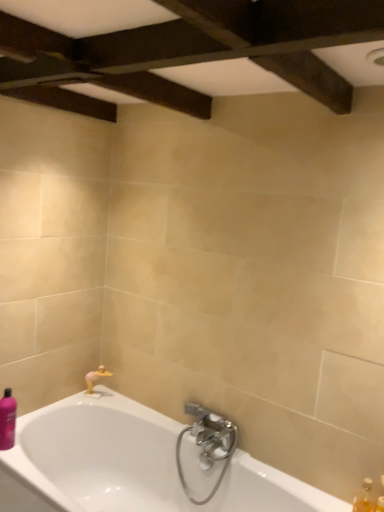
This screenshot has height=512, width=384. Find the location of `purple glossy bottle at lower left, which is counted as the first toiletry, starting from the top`. purple glossy bottle at lower left, which is counted as the first toiletry, starting from the top is located at coordinates (7, 420).

This screenshot has height=512, width=384. What do you see at coordinates (7, 420) in the screenshot?
I see `purple glossy bottle at lower left, the 1th toiletry from the left` at bounding box center [7, 420].

What are the coordinates of `translucent amber bottle at lower right` in the screenshot? It's located at (365, 498).

Locate an element on the screen. white glossy bathtub at lower left is located at coordinates (129, 465).

Is translucent amber bottle at lower right located within white glossy bathtub at lower left?

No.

From the image's perspective, would you say white glossy bathtub at lower left is positioned over translucent amber bottle at lower right?

No, from the image's perspective, white glossy bathtub at lower left is not above translucent amber bottle at lower right.

Between white glossy bathtub at lower left and translucent amber bottle at lower right, which one appears on the right side from the viewer's perspective?

From the viewer's perspective, translucent amber bottle at lower right appears more on the right side.

Is point (94, 434) positioned in front of point (381, 478)?

No, (94, 434) is behind (381, 478).

Would you say white glossy bathtub at lower left contains translucent plastic soap at lower right, the 2th toiletry in the left-to-right sequence?

Definitely not — translucent plastic soap at lower right, the 2th toiletry in the left-to-right sequence, is not inside white glossy bathtub at lower left.

Considering the sizes of white glossy bathtub at lower left and translucent plastic soap at lower right, the first toiletry ordered from the bottom, in the image, is white glossy bathtub at lower left taller or shorter than translucent plastic soap at lower right, the first toiletry ordered from the bottom,?

In the image, white glossy bathtub at lower left appears to be taller than translucent plastic soap at lower right, the first toiletry ordered from the bottom.

From the image's perspective, does white glossy bathtub at lower left appear lower than translucent plastic soap at lower right, the first toiletry ordered from the bottom?

Yes, from the image's perspective, white glossy bathtub at lower left is below translucent plastic soap at lower right, the first toiletry ordered from the bottom.

Are purple glossy bottle at lower left, which is counted as the first toiletry, starting from the top, and translucent plastic soap at lower right, which is the 1th toiletry in front-to-back order, far apart?

Yes, purple glossy bottle at lower left, which is counted as the first toiletry, starting from the top, is far from translucent plastic soap at lower right, which is the 1th toiletry in front-to-back order.

From the image's perspective, is purple glossy bottle at lower left, the 1th toiletry from the left, positioned above or below translucent plastic soap at lower right, the first toiletry ordered from the bottom?

Based on their image positions, purple glossy bottle at lower left, the 1th toiletry from the left, is located above translucent plastic soap at lower right, the first toiletry ordered from the bottom.

Are translucent plastic soap at lower right, the second toiletry when ordered from top to bottom, and white glossy bathtub at lower left far apart?

Yes, translucent plastic soap at lower right, the second toiletry when ordered from top to bottom, and white glossy bathtub at lower left are located far from each other.

From the image's perspective, is translucent plastic soap at lower right, which is the 2th toiletry from back to front, on white glossy bathtub at lower left?

Yes, from the image's perspective, translucent plastic soap at lower right, which is the 2th toiletry from back to front, is over white glossy bathtub at lower left.

Who is smaller, translucent plastic soap at lower right, which is the 1th toiletry in front-to-back order, or white glossy bathtub at lower left?

translucent plastic soap at lower right, which is the 1th toiletry in front-to-back order.

Is translucent plastic soap at lower right, which is the 2th toiletry from back to front, to the left or to the right of white glossy bathtub at lower left in the image?

Based on their positions, translucent plastic soap at lower right, which is the 2th toiletry from back to front, is located to the right of white glossy bathtub at lower left.

Is translucent plastic soap at lower right, the second toiletry when ordered from top to bottom, shorter than translucent amber bottle at lower right?

Incorrect, the height of translucent plastic soap at lower right, the second toiletry when ordered from top to bottom, does not fall short of that of translucent amber bottle at lower right.

Consider the image. Is the depth of translucent plastic soap at lower right, the 2th toiletry in the left-to-right sequence, less than that of translucent amber bottle at lower right?

Yes, translucent plastic soap at lower right, the 2th toiletry in the left-to-right sequence, is closer to the viewer.

Based on the photo, does translucent plastic soap at lower right, arranged as the first toiletry when viewed from the right, have a greater width compared to translucent amber bottle at lower right?

Yes, translucent plastic soap at lower right, arranged as the first toiletry when viewed from the right, is wider than translucent amber bottle at lower right.

From a real-world perspective, does translucent plastic soap at lower right, the second toiletry when ordered from top to bottom, sit lower than translucent amber bottle at lower right?

No, from a real-world perspective, translucent plastic soap at lower right, the second toiletry when ordered from top to bottom, is not under translucent amber bottle at lower right.

Which of these two, translucent plastic soap at lower right, the 2th toiletry in the left-to-right sequence, or purple glossy bottle at lower left, the 1th toiletry in the back-to-front sequence, is thinner?

translucent plastic soap at lower right, the 2th toiletry in the left-to-right sequence, is thinner.

Based on the photo, considering the relative positions of translucent plastic soap at lower right, which is the 2th toiletry from back to front, and purple glossy bottle at lower left, placed as the second toiletry when sorted from right to left, in the image provided, is translucent plastic soap at lower right, which is the 2th toiletry from back to front, in front of purple glossy bottle at lower left, placed as the second toiletry when sorted from right to left,?

Yes, it is.

Measure the distance between translucent plastic soap at lower right, which is the 1th toiletry in front-to-back order, and purple glossy bottle at lower left, acting as the 2th toiletry starting from the bottom.

They are 5.01 feet apart.

Is translucent amber bottle at lower right beside purple glossy bottle at lower left, the 1th toiletry from the left?

No, translucent amber bottle at lower right is not touching purple glossy bottle at lower left, the 1th toiletry from the left.

Which is behind, translucent amber bottle at lower right or purple glossy bottle at lower left, placed as the second toiletry when sorted from right to left?

purple glossy bottle at lower left, placed as the second toiletry when sorted from right to left, is more distant.

Between translucent amber bottle at lower right and purple glossy bottle at lower left, placed as the second toiletry when sorted from right to left, which one has less height?

translucent amber bottle at lower right is shorter.

Is translucent amber bottle at lower right facing towards purple glossy bottle at lower left, placed as the second toiletry when sorted from right to left?

No, translucent amber bottle at lower right is not facing towards purple glossy bottle at lower left, placed as the second toiletry when sorted from right to left.

Image resolution: width=384 pixels, height=512 pixels. Find the location of `bathtub that appears in front of the translucent amber bottle at lower right`. bathtub that appears in front of the translucent amber bottle at lower right is located at coordinates (129, 465).

Which toiletry is the 1st one when counting from the back of the white glossy bathtub at lower left? Please provide its 2D coordinates.

[(380, 504)]

Based on their spatial positions, is translucent amber bottle at lower right or purple glossy bottle at lower left, acting as the 2th toiletry starting from the bottom, closer to white glossy bathtub at lower left?

Among the two, purple glossy bottle at lower left, acting as the 2th toiletry starting from the bottom, is located nearer to white glossy bathtub at lower left.

Which object lies further to the anchor point purple glossy bottle at lower left, acting as the 2th toiletry starting from the bottom, translucent amber bottle at lower right or white glossy bathtub at lower left?

translucent amber bottle at lower right is further to purple glossy bottle at lower left, acting as the 2th toiletry starting from the bottom.

When comparing their distances from white glossy bathtub at lower left, does translucent plastic soap at lower right, which is the 2th toiletry from back to front, or translucent amber bottle at lower right seem closer?

Based on the image, translucent amber bottle at lower right appears to be nearer to white glossy bathtub at lower left.

Estimate the real-world distances between objects in this image. Which object is closer to translucent amber bottle at lower right, purple glossy bottle at lower left, which is counted as the first toiletry, starting from the top, or white glossy bathtub at lower left?

white glossy bathtub at lower left is positioned closer to the anchor translucent amber bottle at lower right.

Looking at the image, which one is located closer to translucent amber bottle at lower right, white glossy bathtub at lower left or purple glossy bottle at lower left, the second toiletry viewed from the front?

white glossy bathtub at lower left lies closer to translucent amber bottle at lower right than the other object.

Consider the image. Considering their positions, is white glossy bathtub at lower left positioned further to purple glossy bottle at lower left, the 1th toiletry from the left, than translucent amber bottle at lower right?

translucent amber bottle at lower right.

Based on their spatial positions, is translucent plastic soap at lower right, which is the 1th toiletry in front-to-back order, or purple glossy bottle at lower left, placed as the second toiletry when sorted from right to left, closer to translucent amber bottle at lower right?

translucent plastic soap at lower right, which is the 1th toiletry in front-to-back order, lies closer to translucent amber bottle at lower right than the other object.

Based on their spatial positions, is translucent plastic soap at lower right, arranged as the first toiletry when viewed from the right, or purple glossy bottle at lower left, which is counted as the first toiletry, starting from the top, closer to white glossy bathtub at lower left?

purple glossy bottle at lower left, which is counted as the first toiletry, starting from the top, is closer to white glossy bathtub at lower left.

The image size is (384, 512). I want to click on bottle situated between purple glossy bottle at lower left, the 1th toiletry in the back-to-front sequence, and translucent plastic soap at lower right, the first toiletry ordered from the bottom, from left to right, so click(365, 498).

I want to click on bathtub situated between purple glossy bottle at lower left, the 1th toiletry in the back-to-front sequence, and translucent amber bottle at lower right from left to right, so click(x=129, y=465).

Find the location of a particular element. The image size is (384, 512). bottle between white glossy bathtub at lower left and translucent plastic soap at lower right, arranged as the first toiletry when viewed from the right, from left to right is located at coordinates (365, 498).

Find the location of a particular element. Image resolution: width=384 pixels, height=512 pixels. bathtub between purple glossy bottle at lower left, the 1th toiletry in the back-to-front sequence, and translucent plastic soap at lower right, arranged as the first toiletry when viewed from the right, in the horizontal direction is located at coordinates (129, 465).